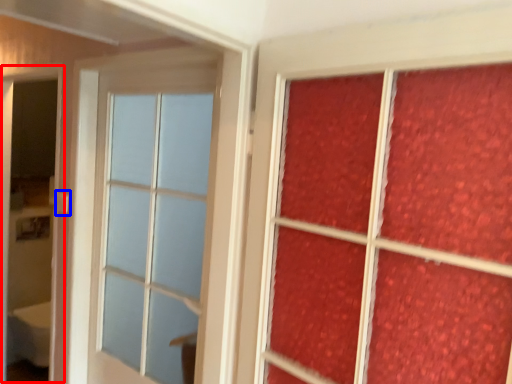
Question: Which of the following is the closest to the observer, screen door (highlighted by a red box) or door handle (highlighted by a blue box)?

Choices:
 (A) screen door
 (B) door handle

Answer: (A)